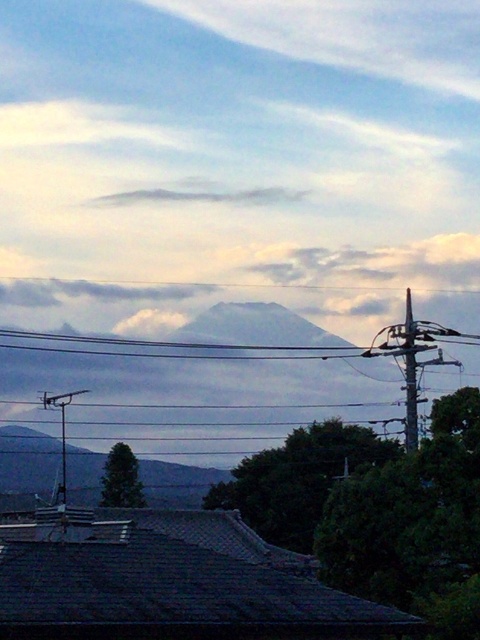
Is white cotton cloud at upper center wider than white fluffy cloud at upper center?

Yes, white cotton cloud at upper center is wider than white fluffy cloud at upper center.

Does white cotton cloud at upper center appear over white fluffy cloud at upper center?

Yes.

Find the location of a particular element. The height and width of the screenshot is (640, 480). white cotton cloud at upper center is located at coordinates (201, 196).

Find the location of a particular element. gray rocky mountain at center is located at coordinates (27, 460).

Between point (154, 490) and point (163, 188), which one is positioned in front?

Point (154, 490)

Where is `gray rocky mountain at center`? This screenshot has height=640, width=480. gray rocky mountain at center is located at coordinates (27, 460).

Does gray rocky mountain at center have a lesser height compared to white fluffy cloud at upper center?

In fact, gray rocky mountain at center may be taller than white fluffy cloud at upper center.

Find the location of a particular element. This screenshot has width=480, height=640. gray rocky mountain at center is located at coordinates (27, 460).

Locate an element on the screen. The width and height of the screenshot is (480, 640). gray rocky mountain at center is located at coordinates (27, 460).